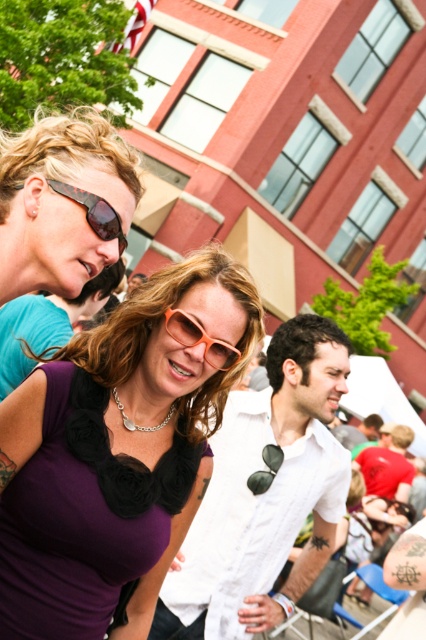
You are at an outdoor event and see two people wearing sunglasses. One has matte black sunglasses at upper left and the other has orange matte sunglasses at center. Which person is positioned more to the left?

The matte black sunglasses at upper left is positioned to the left of the orange matte sunglasses at center, so the person wearing the matte black sunglasses at upper left is more to the left.